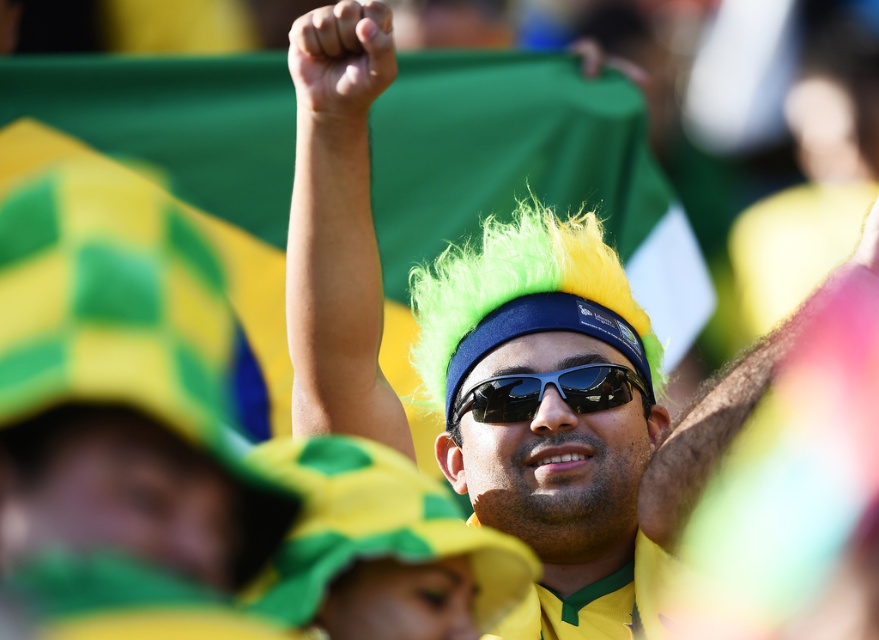
Question: Is fluorescent green wig at center bigger than black plastic goggles at center?

Choices:
 (A) no
 (B) yes

Answer: (B)

Question: Can you confirm if fluorescent green wig at center is positioned to the left of black plastic goggles at center?

Choices:
 (A) no
 (B) yes

Answer: (A)

Question: Is fluorescent green wig at center above black plastic goggles at center?

Choices:
 (A) yes
 (B) no

Answer: (B)